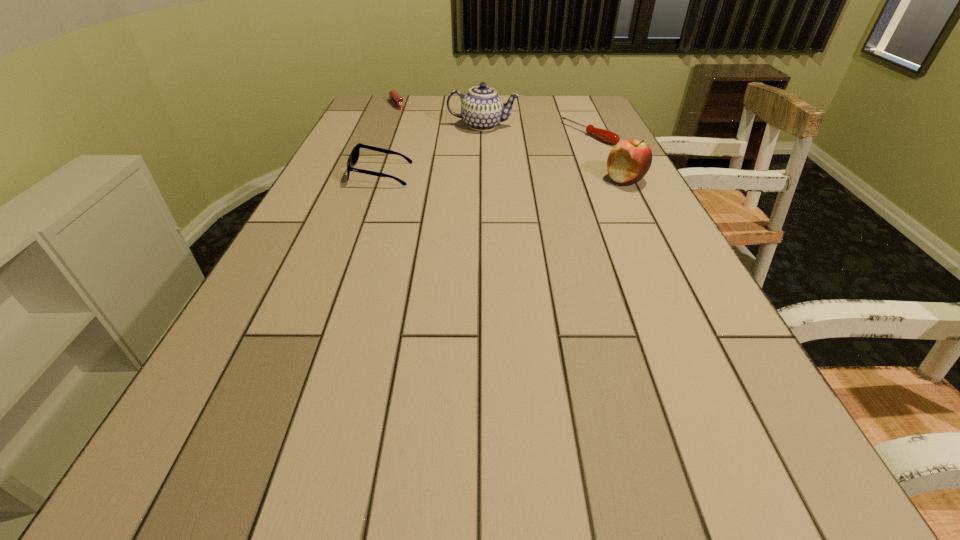
Where is `free location that satisfies the following two spatial constraints: 1. on the front side of the screwdriver; 2. on the right side of the second shortest object`? free location that satisfies the following two spatial constraints: 1. on the front side of the screwdriver; 2. on the right side of the second shortest object is located at coordinates (385, 134).

Where is `vacant region that satisfies the following two spatial constraints: 1. on the front side of the farthest object; 2. on the bitten side of the second tallest object`? Image resolution: width=960 pixels, height=540 pixels. vacant region that satisfies the following two spatial constraints: 1. on the front side of the farthest object; 2. on the bitten side of the second tallest object is located at coordinates (367, 180).

At what (x,y) coordinates should I click in order to perform the action: click on free space that satisfies the following two spatial constraints: 1. on the front side of the second tallest object; 2. on the bitten side of the stapler. Please return your answer as a coordinate pair (x, y). Image resolution: width=960 pixels, height=540 pixels. Looking at the image, I should click on (367, 180).